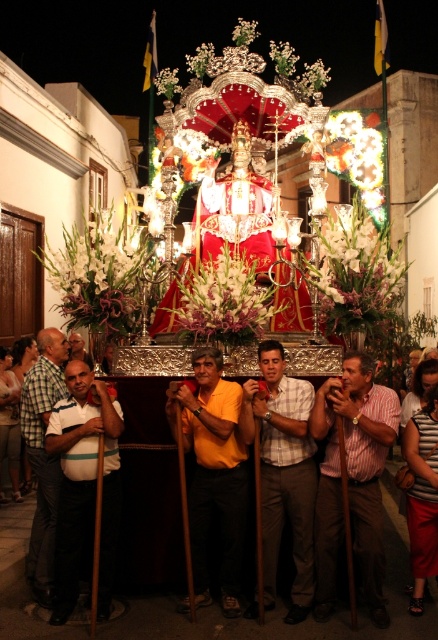
How distant is yellow t-shirt at left from yellow t-shirt at center?

yellow t-shirt at left is 48.92 feet away from yellow t-shirt at center.

In the scene shown: Who is more distant from viewer, (31, 572) or (71, 332)?

Positioned behind is point (71, 332).

Is point (45, 573) behind point (77, 344)?

No.

Locate an element on the screen. This screenshot has width=438, height=640. yellow t-shirt at left is located at coordinates (42, 456).

Is point (293, 378) less distant than point (204, 499)?

No, it is not.

Consider the image. Which of these two, plaid shirt at center or orange fabric shirt at center, stands shorter?

orange fabric shirt at center

Which is in front, point (282, 461) or point (190, 444)?

Positioned in front is point (282, 461).

The width and height of the screenshot is (438, 640). What are the coordinates of `plaid shirt at center` in the screenshot? It's located at (283, 472).

Where is `striped cotton shirt at center`? This screenshot has width=438, height=640. striped cotton shirt at center is located at coordinates (353, 477).

Is striped cotton shirt at center wider than orange fabric shirt at center?

Indeed, striped cotton shirt at center has a greater width compared to orange fabric shirt at center.

Who is more forward, [320,493] or [240,458]?

Point [320,493] is in front.

Image resolution: width=438 pixels, height=640 pixels. In order to click on striped cotton shirt at center in this screenshot , I will do `click(353, 477)`.